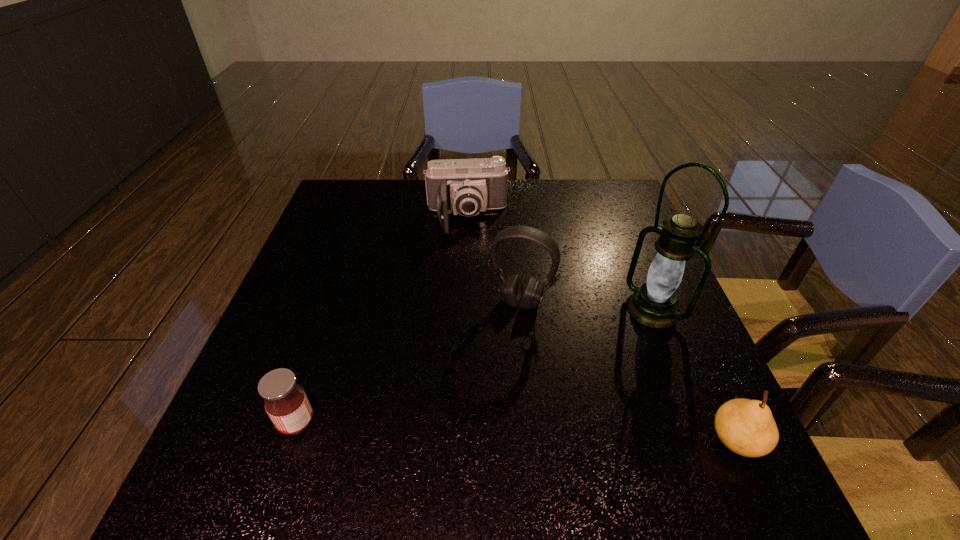
The width and height of the screenshot is (960, 540). I want to click on pear present at the right edge, so click(747, 427).

I want to click on lantern present at the right edge, so click(654, 304).

The width and height of the screenshot is (960, 540). What are the coordinates of `object at the near left corner` in the screenshot? It's located at (286, 403).

This screenshot has width=960, height=540. Identify the location of object present at the near right corner. (747, 427).

Identify the location of free space at the far edge of the desktop. The height and width of the screenshot is (540, 960). (513, 183).

Locate an element on the screen. The height and width of the screenshot is (540, 960). free space at the left edge of the desktop is located at coordinates (258, 346).

I want to click on vacant space at the right edge of the desktop, so click(x=651, y=262).

In the image, there is a desktop. Identify the location of vacant region at the far left corner. Image resolution: width=960 pixels, height=540 pixels. (339, 192).

In the image, there is a desktop. At what (x,y) coordinates should I click in order to perform the action: click on free space at the far right corner. Please return your answer as a coordinate pair (x, y). Image resolution: width=960 pixels, height=540 pixels. Looking at the image, I should click on (624, 184).

At what (x,y) coordinates should I click in order to perform the action: click on blank region between the pear and the lantern. Please return your answer as a coordinate pair (x, y). This screenshot has height=540, width=960. Looking at the image, I should click on (694, 375).